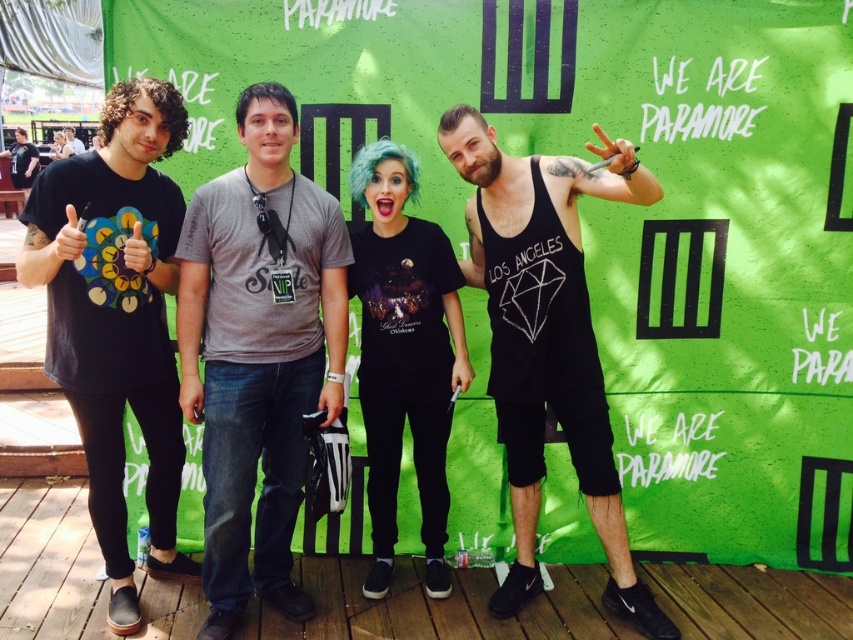
Between gray cotton t-shirt at center and matte black t-shirt at left, which one appears on the left side from the viewer's perspective?

matte black t-shirt at left is more to the left.

Who is more forward, (245, 435) or (143, 138)?

Point (143, 138) is more forward.

The height and width of the screenshot is (640, 853). What are the coordinates of `gray cotton t-shirt at center` in the screenshot? It's located at (259, 353).

Consider the image. Does matte black t-shirt at left have a lesser height compared to black matte t-shirt at center?

In fact, matte black t-shirt at left may be taller than black matte t-shirt at center.

The width and height of the screenshot is (853, 640). In order to click on matte black t-shirt at left in this screenshot , I will do `click(115, 317)`.

Is matte black t-shirt at left wider than black tank top at center?

Incorrect, matte black t-shirt at left's width does not surpass black tank top at center's.

What do you see at coordinates (115, 317) in the screenshot?
I see `matte black t-shirt at left` at bounding box center [115, 317].

Where is `matte black t-shirt at left`? This screenshot has height=640, width=853. matte black t-shirt at left is located at coordinates (115, 317).